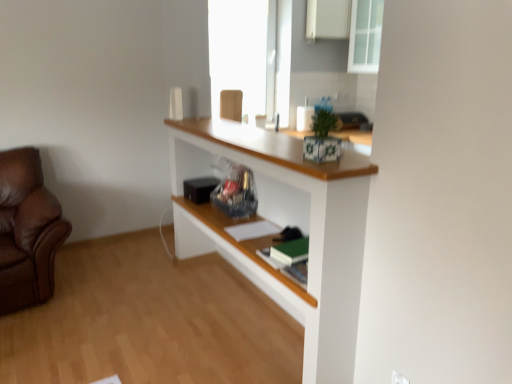
Question: Considering the relative sizes of white matte cabinet at upper center and green matte book at center, positioned as the 1th book in bottom-to-top order, in the image provided, is white matte cabinet at upper center taller than green matte book at center, positioned as the 1th book in bottom-to-top order,?

Choices:
 (A) no
 (B) yes

Answer: (B)

Question: Is white matte cabinet at upper center outside of green matte book at center, positioned as the 1th book in bottom-to-top order?

Choices:
 (A) no
 (B) yes

Answer: (B)

Question: From the image's perspective, is white matte cabinet at upper center on top of green matte book at center, positioned as the 1th book in bottom-to-top order?

Choices:
 (A) yes
 (B) no

Answer: (A)

Question: Considering the relative positions of white matte cabinet at upper center and green matte book at center, acting as the 2th book starting from the back, in the image provided, is white matte cabinet at upper center to the left of green matte book at center, acting as the 2th book starting from the back, from the viewer's perspective?

Choices:
 (A) yes
 (B) no

Answer: (B)

Question: Is white matte cabinet at upper center smaller than green matte book at center, acting as the 2th book starting from the back?

Choices:
 (A) no
 (B) yes

Answer: (A)

Question: From a real-world perspective, is green matte book at center, positioned as the 1th book in bottom-to-top order, physically located above or below white matte cabinet at upper center?

Choices:
 (A) below
 (B) above

Answer: (A)

Question: In terms of size, does green matte book at center, positioned as the 1th book in bottom-to-top order, appear bigger or smaller than white matte cabinet at upper center?

Choices:
 (A) big
 (B) small

Answer: (B)

Question: Is green matte book at center, which appears as the second book when viewed from the top, to the left or to the right of white matte cabinet at upper center in the image?

Choices:
 (A) right
 (B) left

Answer: (B)

Question: Considering the positions of green matte book at center, acting as the 2th book starting from the back, and white matte cabinet at upper center in the image, is green matte book at center, acting as the 2th book starting from the back, taller or shorter than white matte cabinet at upper center?

Choices:
 (A) short
 (B) tall

Answer: (A)

Question: Do you think white plastic electric outlet at lower right is within white matte cabinet at upper center, or outside of it?

Choices:
 (A) outside
 (B) inside

Answer: (A)

Question: Is white plastic electric outlet at lower right wider or thinner than white matte cabinet at upper center?

Choices:
 (A) wide
 (B) thin

Answer: (B)

Question: From a real-world perspective, is white plastic electric outlet at lower right positioned above or below white matte cabinet at upper center?

Choices:
 (A) above
 (B) below

Answer: (B)

Question: In terms of size, does white plastic electric outlet at lower right appear bigger or smaller than white matte cabinet at upper center?

Choices:
 (A) small
 (B) big

Answer: (A)

Question: From the image's perspective, is transparent glass cabinet at upper right above or below white painted wood shelf at center?

Choices:
 (A) below
 (B) above

Answer: (B)

Question: Is point (359, 16) positioned closer to the camera than point (360, 243)?

Choices:
 (A) farther
 (B) closer

Answer: (A)